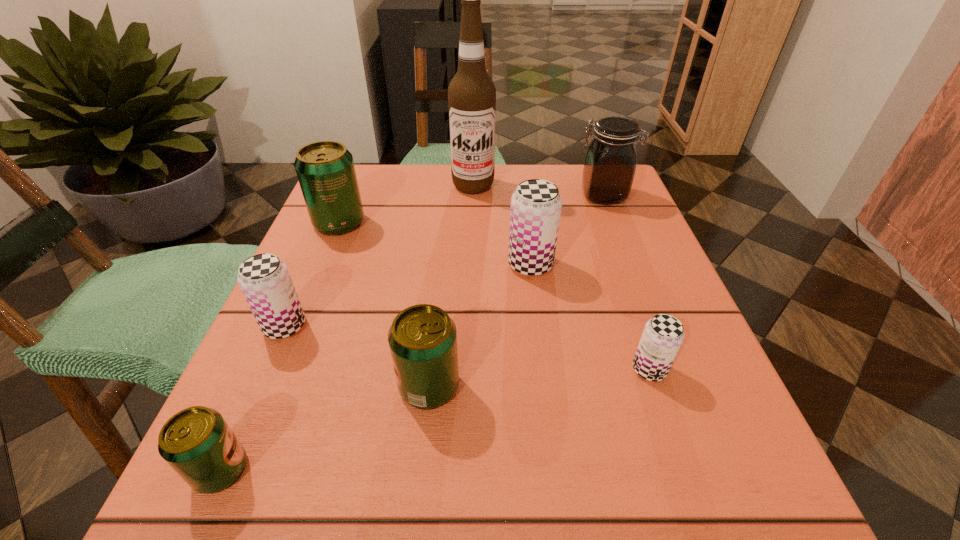
Where is `alcohol`? alcohol is located at coordinates (471, 94).

Where is `jar`? The image size is (960, 540). jar is located at coordinates (610, 162).

The image size is (960, 540). Identify the location of the farthest beer can. (325, 169).

The height and width of the screenshot is (540, 960). Find the location of `the sixth nearest object`. the sixth nearest object is located at coordinates (325, 169).

At what (x,y) coordinates should I click in order to perform the action: click on the fourth farthest object. Please return your answer as a coordinate pair (x, y). This screenshot has width=960, height=540. Looking at the image, I should click on (536, 204).

At what (x,y) coordinates should I click in order to perform the action: click on the sixth object from left to right. Please return your answer as a coordinate pair (x, y). This screenshot has width=960, height=540. Looking at the image, I should click on (536, 204).

Where is `the fifth farthest object`? Image resolution: width=960 pixels, height=540 pixels. the fifth farthest object is located at coordinates (264, 279).

Locate an element on the screen. This screenshot has height=540, width=960. the second nearest purple beer can is located at coordinates (264, 279).

In order to click on the fourth beer can from left to right in this screenshot , I will do `click(422, 338)`.

Find the location of a particular element. This screenshot has width=960, height=540. the second smallest green beer can is located at coordinates (422, 338).